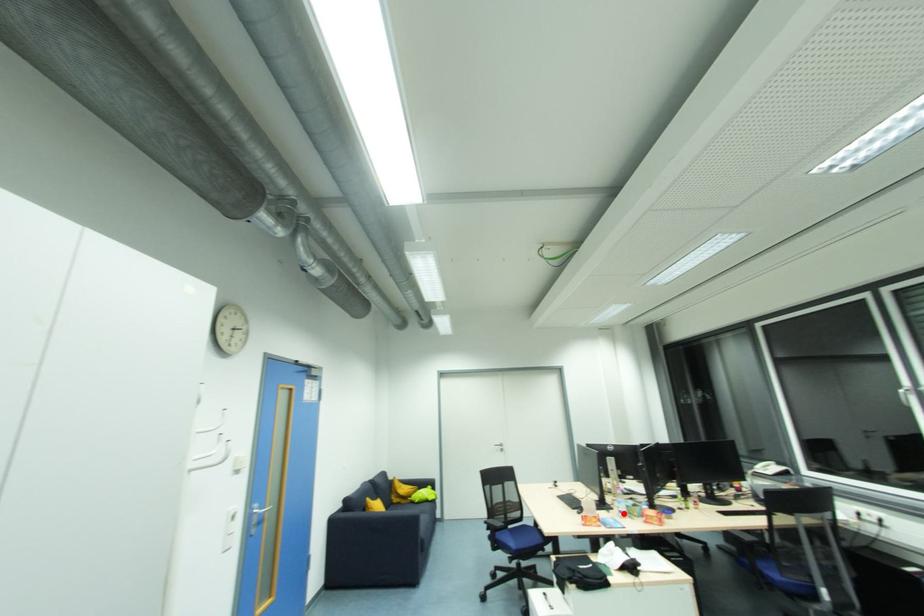
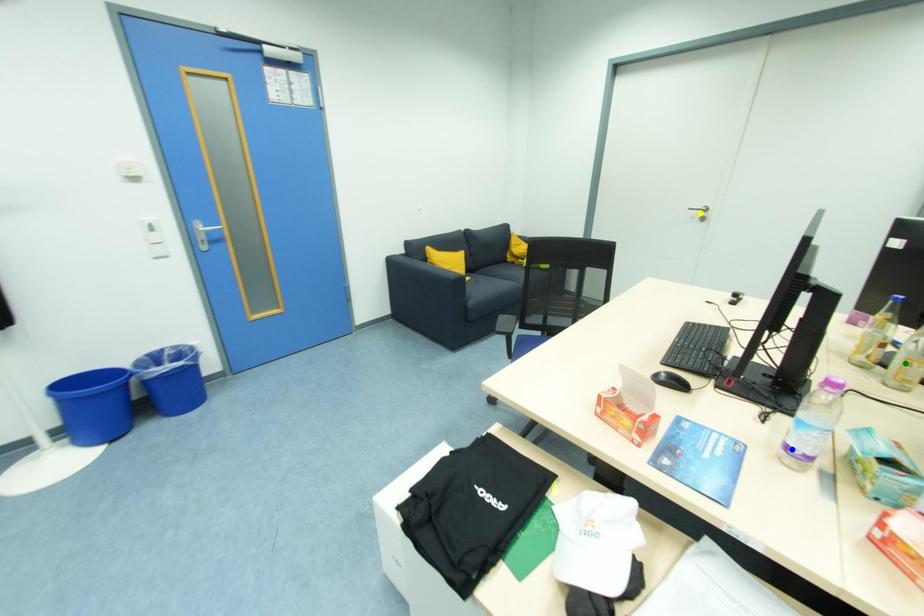
Question: I am providing you with two images of the same scene from different viewpoints. A red point is marked on the first image. You are given multiple points on the second image. Which mark in image 2 goes with the point in image 1?

Choices:
 (A) blue point
 (B) green point
 (C) yellow point

Answer: (A)